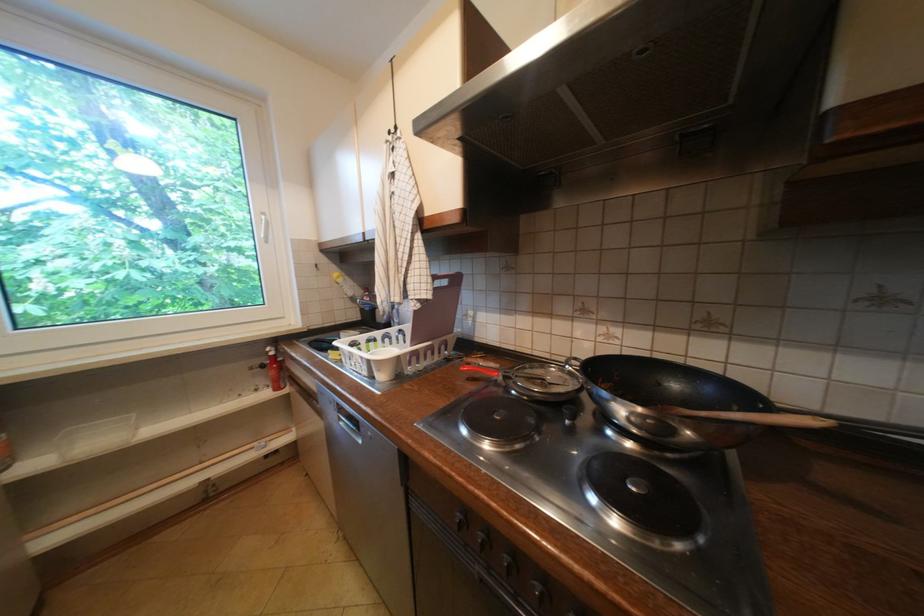
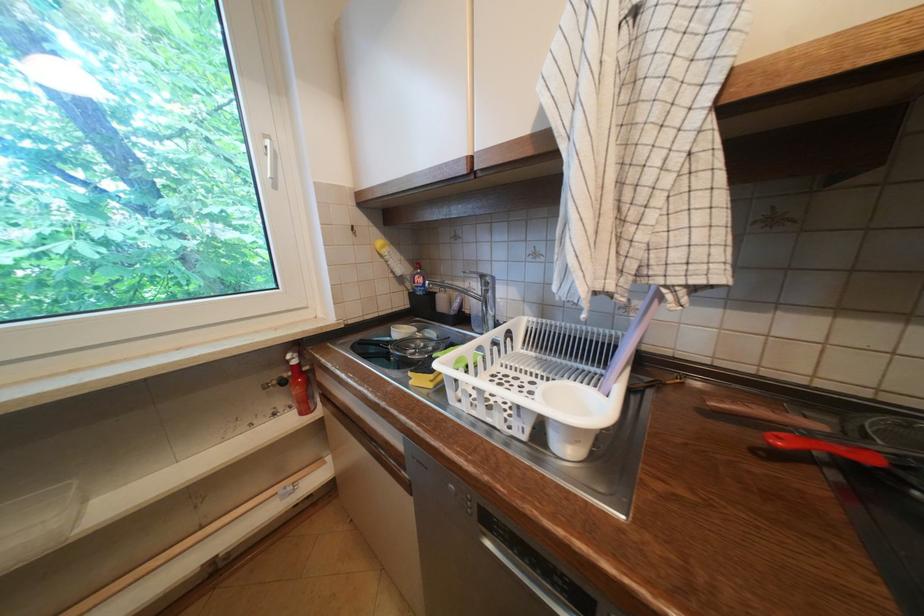
Question: How did the camera likely rotate?

Choices:
 (A) Left
 (B) Right
 (C) Up
 (D) Down

Answer: (D)